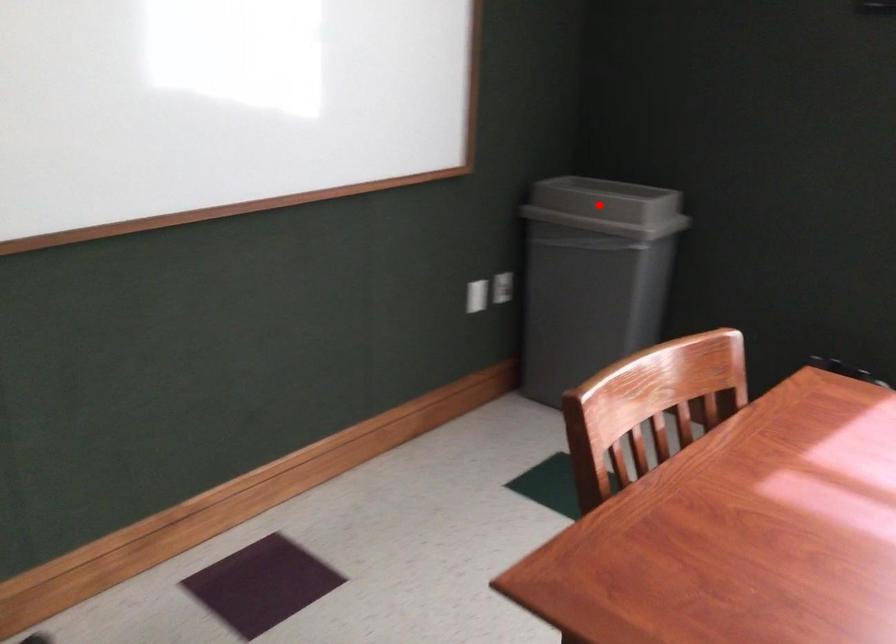
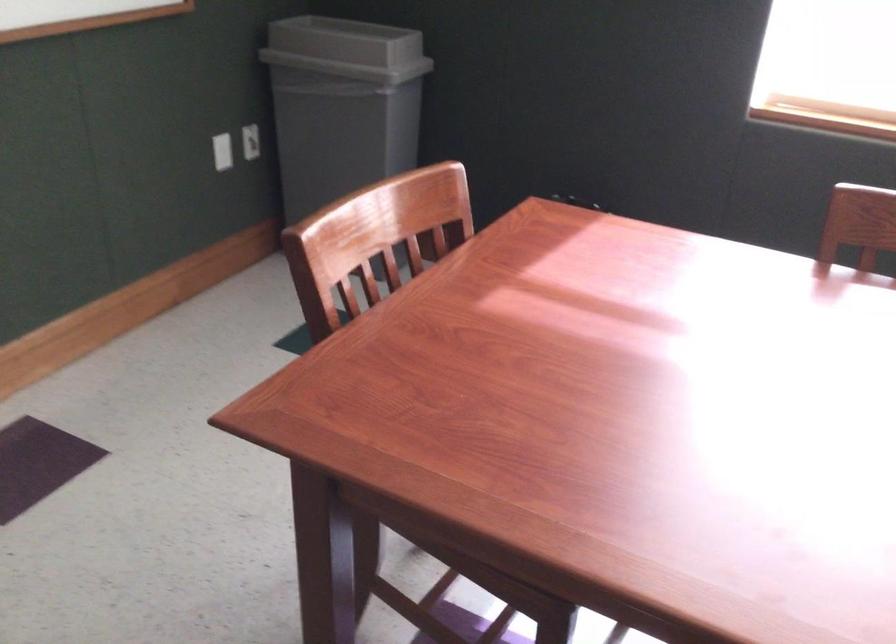
Locate, in the second image, the point that corresponds to the highlighted location in the first image.

(346, 49)